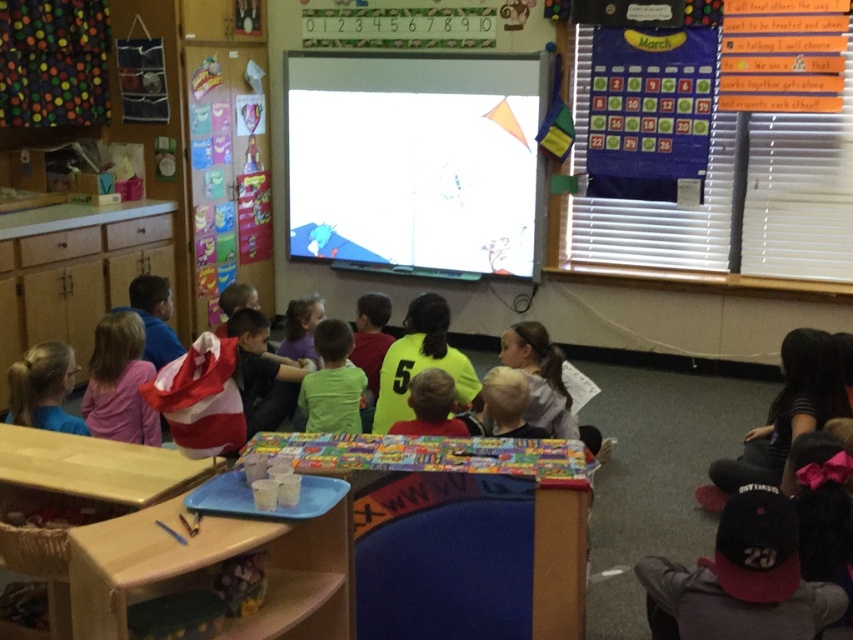
Is point (120, 388) behind point (427, 369)?

Yes, point (120, 388) is farther from viewer.

This screenshot has width=853, height=640. What do you see at coordinates (119, 381) in the screenshot? I see `pink fabric at left` at bounding box center [119, 381].

I want to click on pink fabric at left, so click(x=119, y=381).

The height and width of the screenshot is (640, 853). What do you see at coordinates (785, 413) in the screenshot?
I see `black fabric at lower right` at bounding box center [785, 413].

Which is behind, point (834, 368) or point (318, 420)?

Point (318, 420)

This screenshot has width=853, height=640. Identify the location of black fabric at lower right. (785, 413).

Who is taller, white glossy screen at upper center or pink fabric at left?

white glossy screen at upper center

Is point (508, 116) less distant than point (134, 376)?

No, (508, 116) is behind (134, 376).

Does point (364, 243) come in front of point (85, 410)?

No, it is not.

I want to click on white glossy screen at upper center, so click(x=415, y=160).